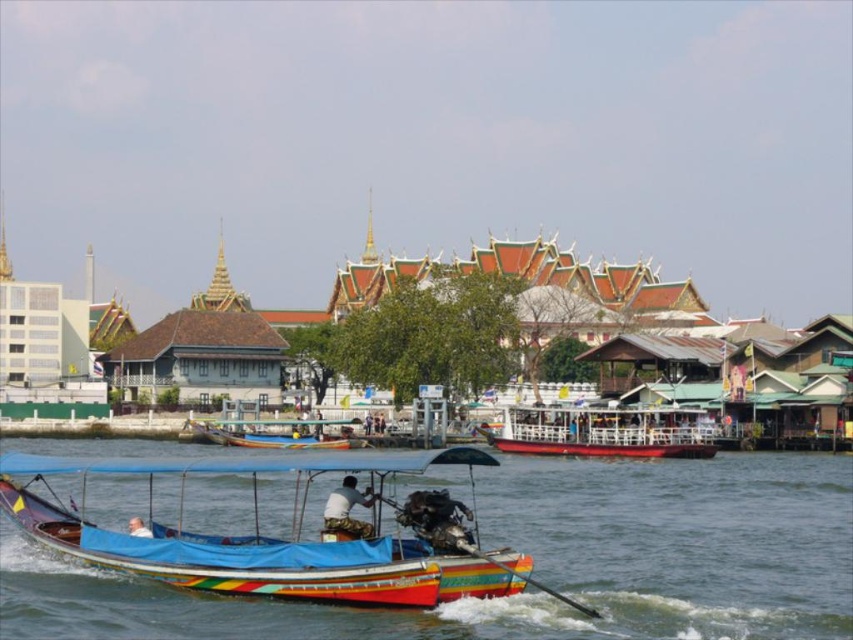
You are a tourist standing on the dock and looking at the golden ornate palace at center and the wooden boat at center. Which one is higher from your viewpoint?

The golden ornate palace at center is above the wooden boat at center, so it is higher from your viewpoint.

Consider the image. You are a tourist standing on the dock and see the multicolored fabric boat at center and the wooden boat at center. Which boat is positioned higher in the image?

The multicolored fabric boat at center is positioned higher than the wooden boat at center in the image.

From the picture: You are standing on the dock and want to board the multicolored fabric boat at center. The boat is currently 159.39 feet away from you. If you walk towards it at a speed of 3 feet per second, how many seconds will it take you to reach the boat?

The multicolored fabric boat at center is 159.39 feet away from the viewer. Walking at 3 feet per second, it will take 159.39 divided by 3, which equals approximately 53.13 seconds to reach the boat.